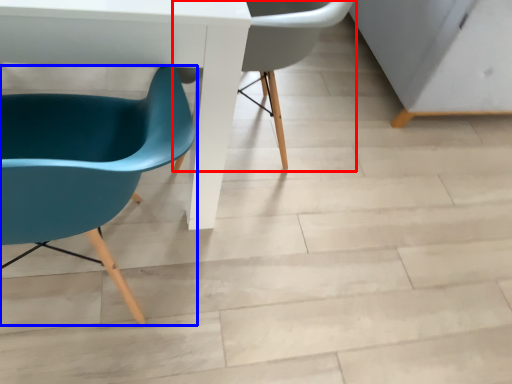
Question: Which point is further to the camera, chair (highlighted by a red box) or chair (highlighted by a blue box)?

Choices:
 (A) chair
 (B) chair

Answer: (A)